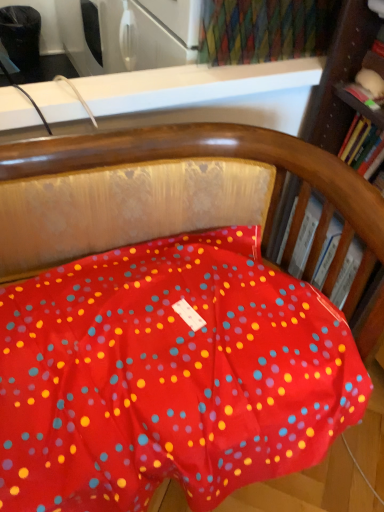
Question: Do you think hardcover book at right, acting as the 2th book starting from the bottom, is within hardcover book at right, arranged as the 2th book when viewed from the top, or outside of it?

Choices:
 (A) inside
 (B) outside

Answer: (B)

Question: In the image, is hardcover book at right, acting as the 2th book starting from the bottom, on the left side or the right side of hardcover book at right, the 1th book positioned from the bottom?

Choices:
 (A) left
 (B) right

Answer: (B)

Question: From the image's perspective, is hardcover book at right, acting as the 2th book starting from the bottom, positioned above or below hardcover book at right, arranged as the 2th book when viewed from the top?

Choices:
 (A) above
 (B) below

Answer: (A)

Question: Looking at their shapes, would you say hardcover book at right, arranged as the 2th book when viewed from the top, is wider or thinner than hardcover book at right, positioned as the first book in top-to-bottom order?

Choices:
 (A) thin
 (B) wide

Answer: (B)

Question: Is point click(x=336, y=304) closer or farther from the camera than point click(x=349, y=137)?

Choices:
 (A) closer
 (B) farther

Answer: (A)

Question: Is hardcover book at right, the 1th book positioned from the bottom, in front of or behind hardcover book at right, acting as the 2th book starting from the bottom, in the image?

Choices:
 (A) behind
 (B) front

Answer: (A)

Question: Based on their positions, is hardcover book at right, arranged as the 2th book when viewed from the top, located to the left or right of hardcover book at right, acting as the 2th book starting from the bottom?

Choices:
 (A) left
 (B) right

Answer: (A)